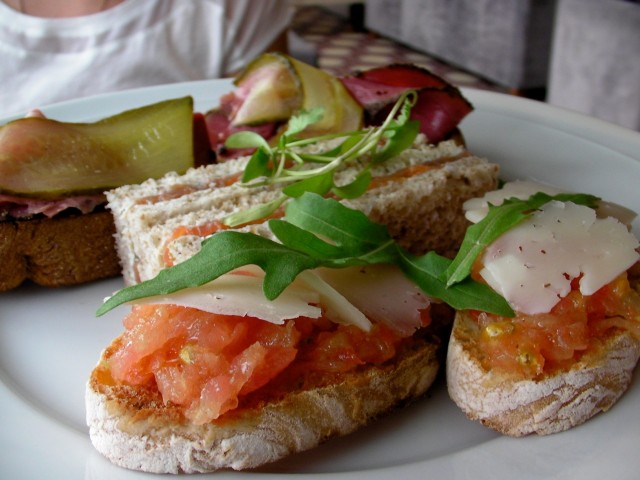
The image size is (640, 480). In order to click on white plate in this screenshot , I will do `click(180, 58)`, `click(605, 163)`.